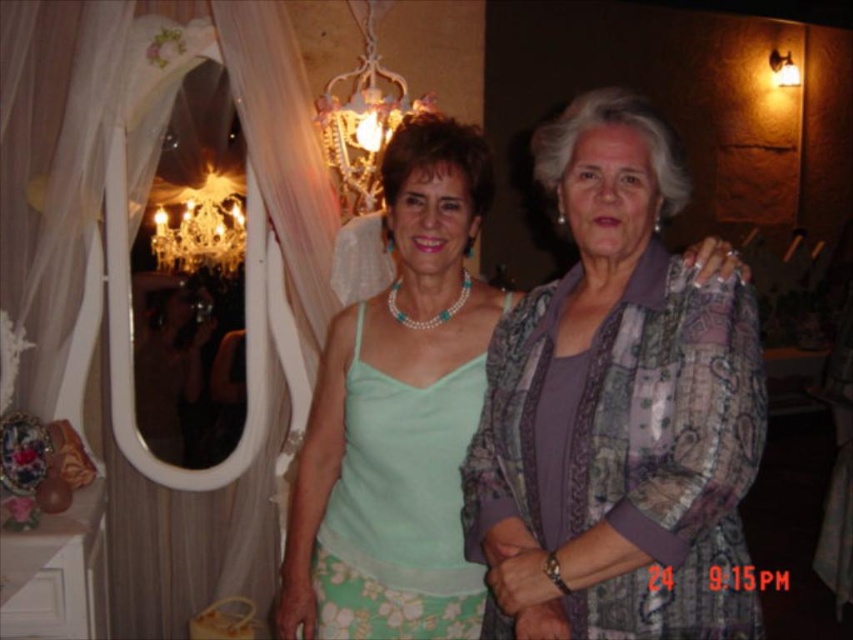
Question: Which of the following is the farthest from the observer?

Choices:
 (A) crystal glass chandelier at upper left
 (B) shiny glass chandelier at upper center

Answer: (A)

Question: Which object appears farthest from the camera in this image?

Choices:
 (A) patterned fabric blouse at center
 (B) shiny glass chandelier at upper center

Answer: (B)

Question: Where is patterned fabric blouse at center located in relation to crystal glass chandelier at upper left in the image?

Choices:
 (A) right
 (B) left

Answer: (A)

Question: Is patterned fabric blouse at center below shiny glass chandelier at upper center?

Choices:
 (A) yes
 (B) no

Answer: (A)

Question: Which of these objects is positioned closest to the patterned fabric blouse at center?

Choices:
 (A) crystal glass chandelier at upper left
 (B) shiny glass chandelier at upper center

Answer: (B)

Question: Observing the image, what is the correct spatial positioning of shiny glass chandelier at upper center in reference to crystal glass chandelier at upper left?

Choices:
 (A) below
 (B) above

Answer: (B)